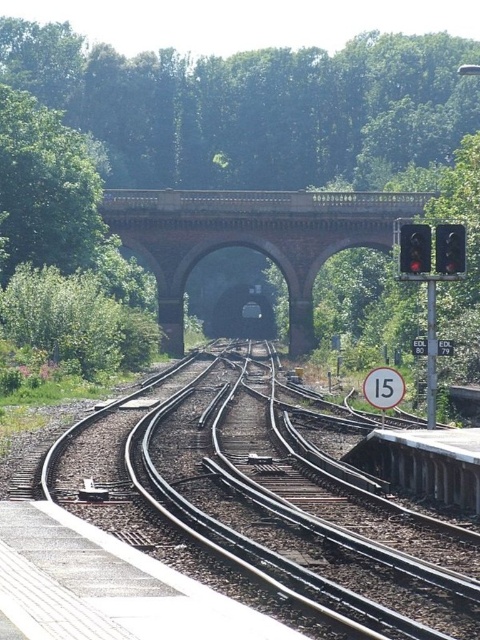
Question: Which object is closer to the camera taking this photo?

Choices:
 (A) brick stone bridge at center
 (B) green leafy trees at upper center
 (C) black glass traffic light at right

Answer: (C)

Question: Can you confirm if metal/smooth train track at center is smaller than black glass traffic light at right?

Choices:
 (A) yes
 (B) no

Answer: (B)

Question: Is black glass traffic light at right bigger than red glass traffic light at right?

Choices:
 (A) yes
 (B) no

Answer: (B)

Question: Is metal/smooth train track at center closer to camera compared to green leafy trees at upper center?

Choices:
 (A) no
 (B) yes

Answer: (B)

Question: Which is farther from the red glass traffic light at right?

Choices:
 (A) brick stone bridge at center
 (B) black glass traffic light at right

Answer: (A)

Question: Which point is farther to the camera?

Choices:
 (A) (405, 250)
 (B) (205, 384)

Answer: (B)